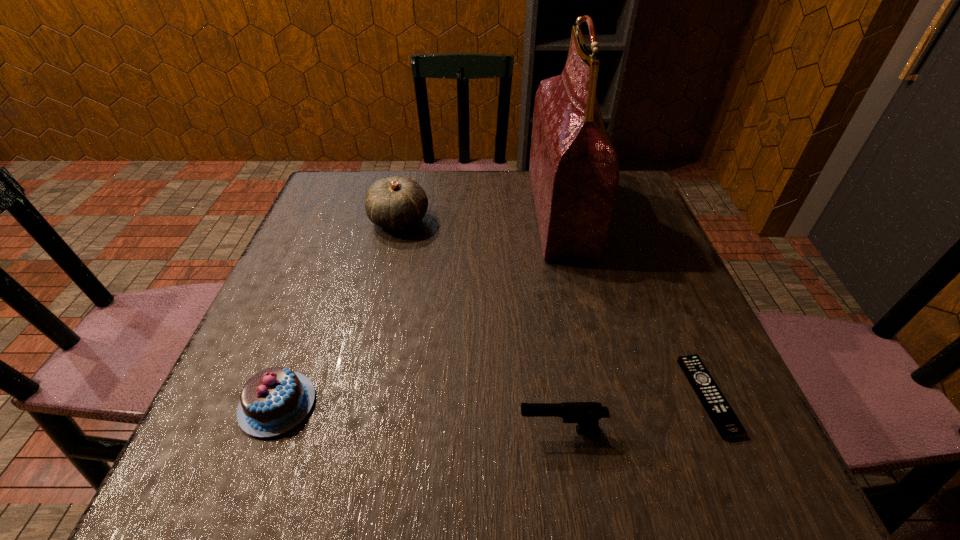
Locate an element on the screen. the tallest object is located at coordinates (574, 171).

Where is `gourd`? This screenshot has width=960, height=540. gourd is located at coordinates (396, 203).

Identify the location of pistol. (586, 414).

Locate an element on the screen. chocolate cake is located at coordinates tap(275, 400).

At what (x,y) coordinates should I click in order to perform the action: click on remote control. Please return your answer as a coordinate pair (x, y). Looking at the image, I should click on (728, 425).

This screenshot has height=540, width=960. I want to click on the rightmost object, so click(728, 425).

You are a GUI agent. You are given a task and a screenshot of the screen. Output one action in this format:
    pyautogui.click(x=<x>, y=<y>)
    Task: Click on the vacant space located 0.060m on the front-facing side of the handbag
    The image size is (960, 540).
    Given the screenshot: What is the action you would take?
    pyautogui.click(x=511, y=212)

At what (x,y) coordinates should I click in order to perform the action: click on free spot located 0.180m on the front-facing side of the handbag. Please return your answer as a coordinate pair (x, y). Looking at the image, I should click on 464,212.

I want to click on free space located on the front-facing side of the handbag, so [400, 212].

Identify the location of vacant space positioned on the front of the gourd. The height and width of the screenshot is (540, 960). (381, 298).